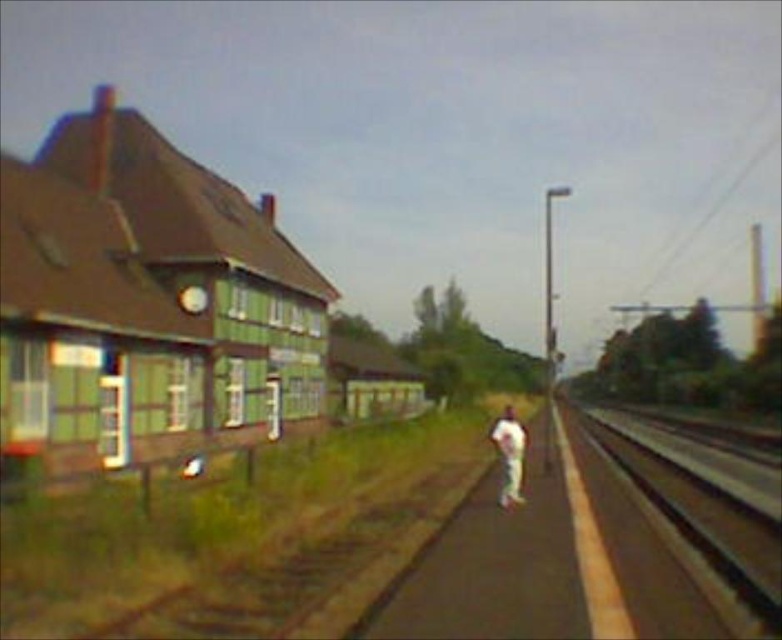
Question: Which point is farther to the camera?

Choices:
 (A) white cotton pants at center
 (B) smooth asphalt train track at right

Answer: (A)

Question: Which point is closer to the camera taking this photo?

Choices:
 (A) (766, 564)
 (B) (522, 456)

Answer: (A)

Question: Is smooth asphalt train track at right above white cotton pants at center?

Choices:
 (A) no
 (B) yes

Answer: (B)

Question: Does smooth asphalt train track at right lie in front of white cotton pants at center?

Choices:
 (A) yes
 (B) no

Answer: (A)

Question: Can you confirm if smooth asphalt train track at right is thinner than white cotton pants at center?

Choices:
 (A) yes
 (B) no

Answer: (B)